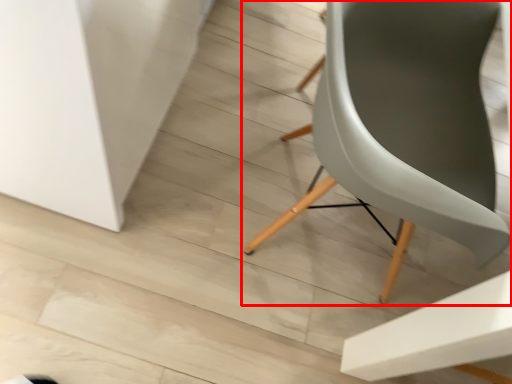
Question: Considering the relative positions of chair (annotated by the red box) and table in the image provided, where is chair (annotated by the red box) located with respect to the staircase?

Choices:
 (A) right
 (B) left

Answer: (A)